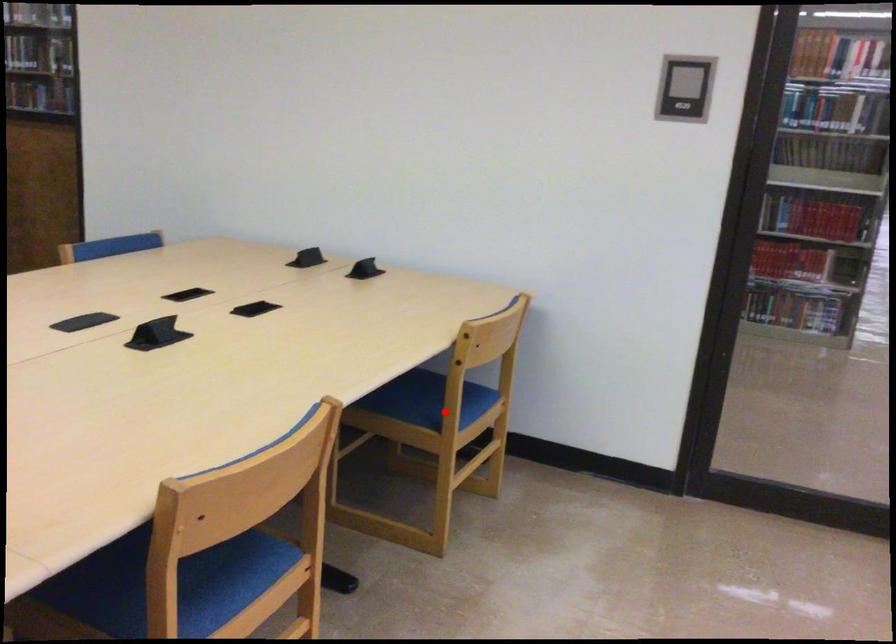
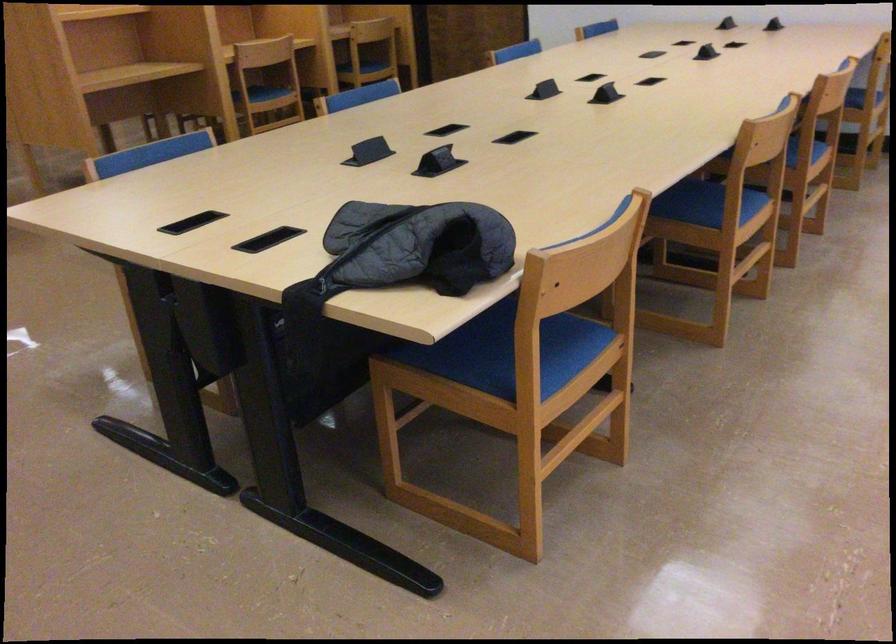
Locate, in the second image, the point that corresponds to the highlighted location in the first image.

(869, 90)